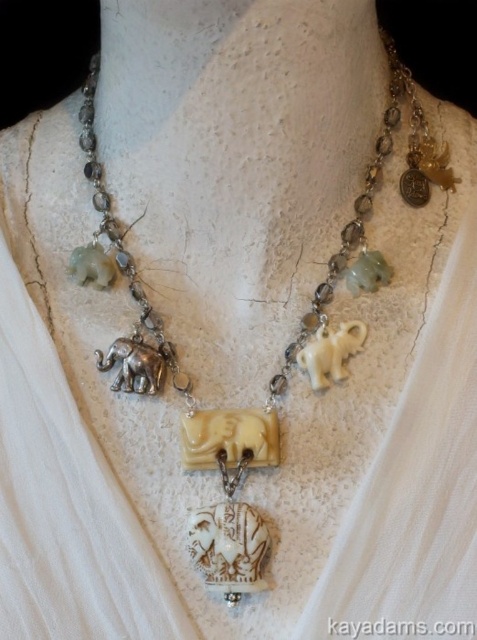
Question: Which point is farther to the camera?

Choices:
 (A) (126, 344)
 (B) (323, 358)

Answer: (A)

Question: Is white ivory elephant at center behind silver metallic elephant at center?

Choices:
 (A) yes
 (B) no

Answer: (B)

Question: Which of the following is the farthest from the observer?

Choices:
 (A) (135, 333)
 (B) (341, 336)

Answer: (A)

Question: Is white ivory elephant at center below silver metallic elephant at center?

Choices:
 (A) yes
 (B) no

Answer: (B)

Question: From the image, what is the correct spatial relationship of white ivory elephant at center in relation to silver metallic elephant at center?

Choices:
 (A) left
 (B) right

Answer: (B)